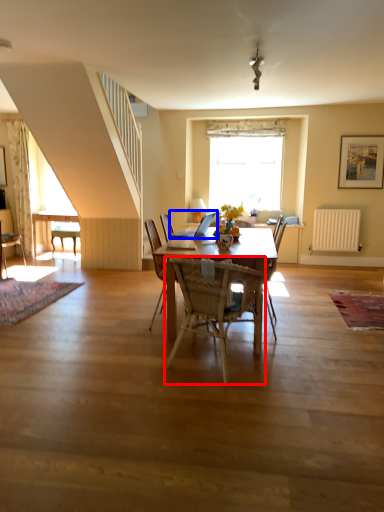
Question: Which object is further to the camera taking this photo, chair (highlighted by a red box) or laptop (highlighted by a blue box)?

Choices:
 (A) chair
 (B) laptop

Answer: (B)